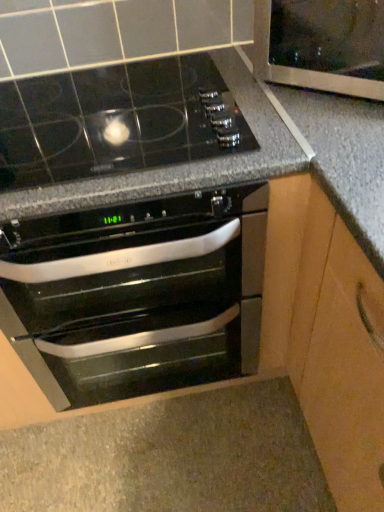
At what (x,y) coordinates should I click in order to perform the action: click on free space above black glass oven at center (from a real-world perspective). Please return your answer as a coordinate pair (x, y). Looking at the image, I should click on 107,124.